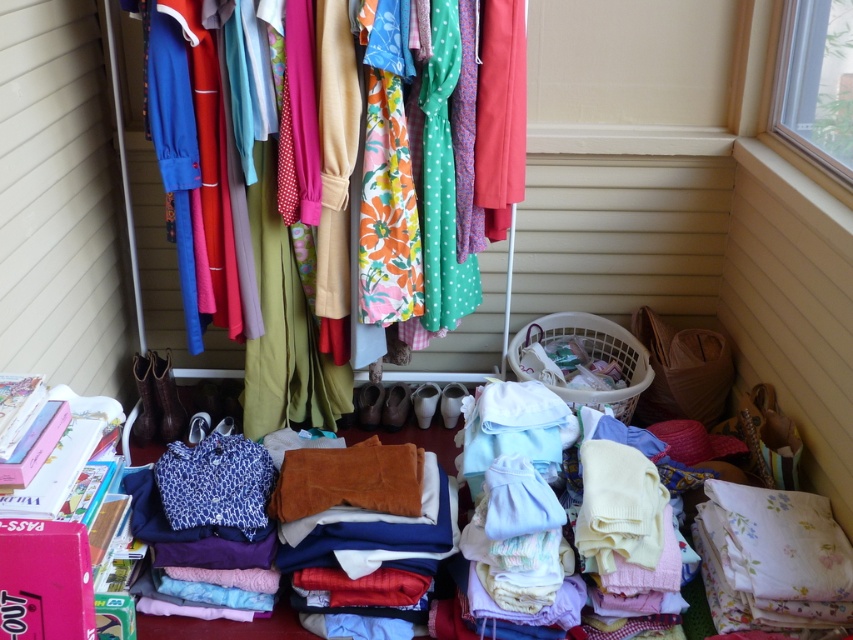
You are organizing the storage area and need to place a new item on the shelf above the white plastic laundry basket at lower center. However, you notice the matte fabric clothes at center are already occupying that space. Can you place the new item there without moving the existing clothes?

The matte fabric clothes at center are located above the white plastic laundry basket at lower center, so the space above the basket is already occupied by the clothes. You cannot place the new item there without moving the existing clothes.

You are standing in the storage area and notice a specific point marked at coordinates (149,244). Based on the scene description, what type of surface does this point lie on?

The point at (149,244) is on matte fabric clothes at center.